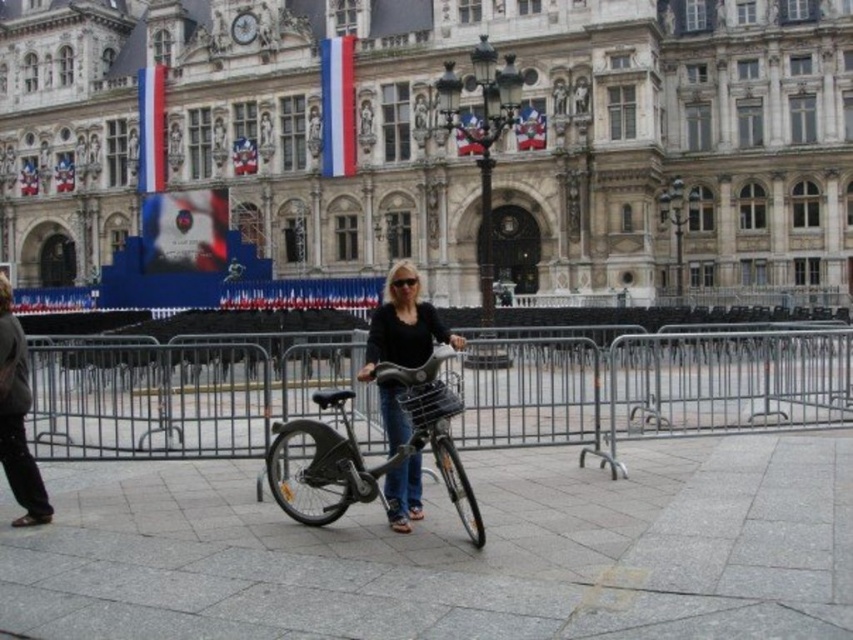
Question: Is gray stone pavement at center behind metallic silver fence at center?

Choices:
 (A) no
 (B) yes

Answer: (A)

Question: Based on their relative distances, which object is farther from the gray stone pavement at center?

Choices:
 (A) stone building at center
 (B) matte black bicycle at center
 (C) metallic silver fence at center
 (D) dark gray pants at left

Answer: (A)

Question: Which object is the closest to the metallic silver fence at center?

Choices:
 (A) dark gray pants at left
 (B) matte black bicycle at center

Answer: (B)

Question: Does stone building at center have a larger size compared to metallic silver bicycle at center?

Choices:
 (A) no
 (B) yes

Answer: (B)

Question: Which object is closer to the camera taking this photo?

Choices:
 (A) gray stone pavement at center
 (B) metallic silver fence at center

Answer: (A)

Question: Can you confirm if metallic silver bicycle at center is positioned below dark gray pants at left?

Choices:
 (A) no
 (B) yes

Answer: (B)